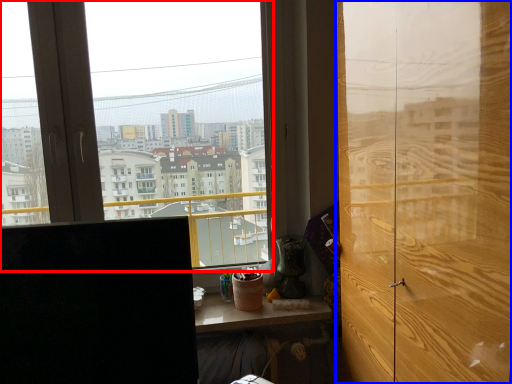
Question: Which object is closer to the camera taking this photo, window (highlighted by a red box) or door (highlighted by a blue box)?

Choices:
 (A) window
 (B) door

Answer: (B)